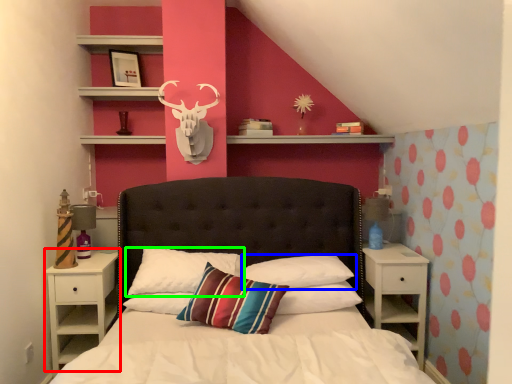
Question: Estimate the real-world distances between objects in this image. Which object is farther from nightstand (highlighted by a red box), pillow (highlighted by a blue box) or pillow (highlighted by a green box)?

Choices:
 (A) pillow
 (B) pillow

Answer: (A)